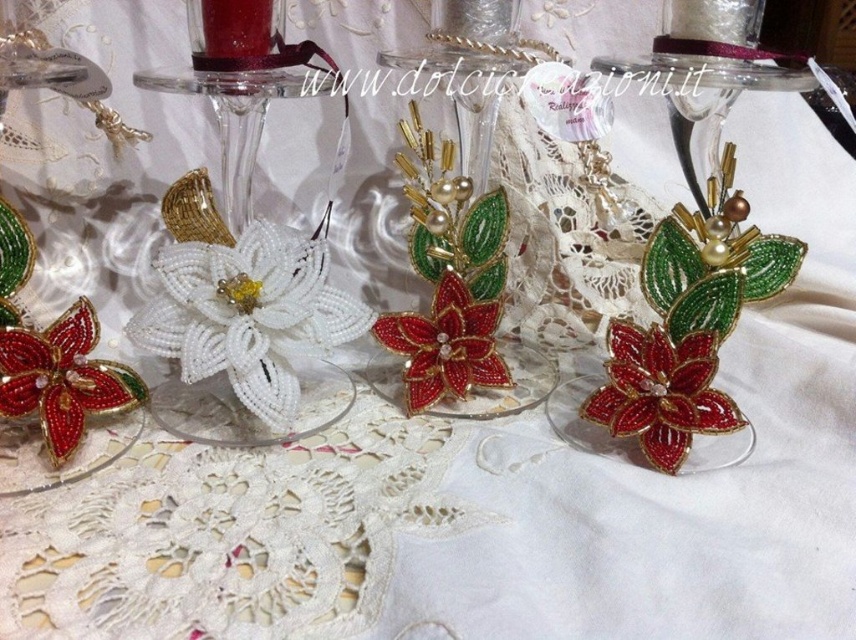
You are a customer at an art gallery and want to examine both the white beaded flower at center left and the shiny red beaded flower at center right. Which flower should you move closer to first to get a better look?

You should move closer to the white beaded flower at center left first because it is closer to you than the shiny red beaded flower at center right, so you can examine it more easily before moving on to the other one.

You are a customer at a craft fair and see two red beaded flowers displayed on a lace table. The first is the matte red beaded flower at lower left and the second is the shiny red beaded flower at center. Which one is positioned lower on the table?

The matte red beaded flower at lower left is positioned lower on the table than the shiny red beaded flower at center.

Consider the image. You are a photographer adjusting your camera settings to capture the decorative items on the lace surface. You notice two points marked in the scene. Which point, point 1 at coordinates point (33, 412) or point 2 at coordinates point (437, 289), is closer to your camera lens?

Point 1 at coordinates point (33, 412) is closer to the camera lens than point 2 at coordinates point (437, 289).